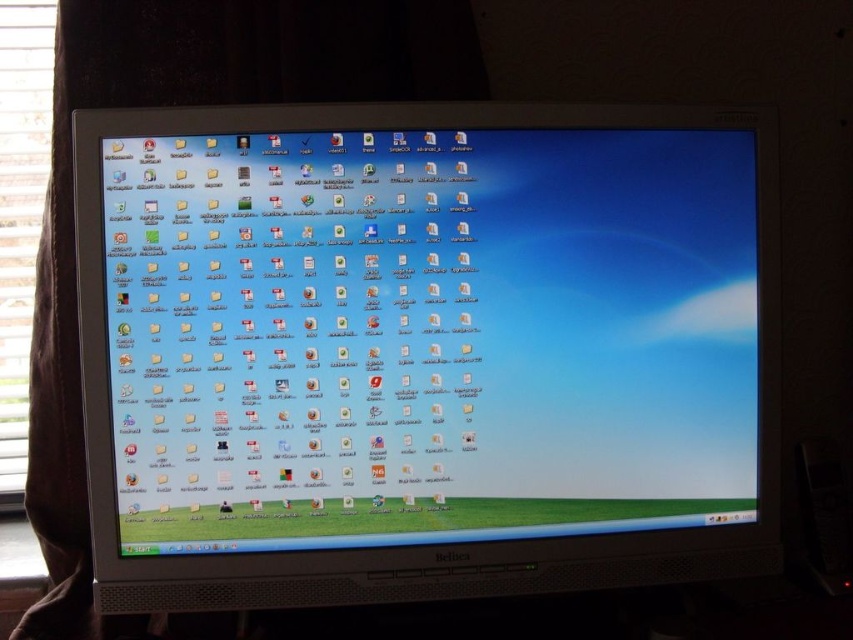
What do you see at coordinates (422, 352) in the screenshot? The height and width of the screenshot is (640, 853). I see `white glossy monitor at center` at bounding box center [422, 352].

Who is lower down, white glossy monitor at center or white wood window at left?

white glossy monitor at center is lower down.

Between point (368, 259) and point (45, 173), which one is positioned in front?

Point (368, 259) is more forward.

Identify the location of white glossy monitor at center. The height and width of the screenshot is (640, 853). (422, 352).